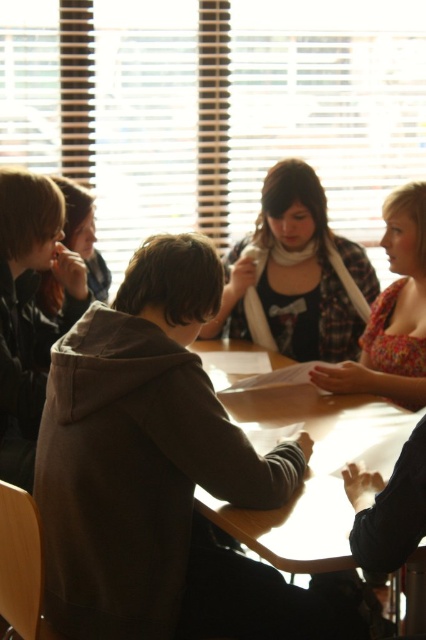
Can you confirm if dark brown hoodie at center is smaller than floral fabric dress at right?

No, dark brown hoodie at center is not smaller than floral fabric dress at right.

Between point (169, 474) and point (394, 244), which one is positioned in front?

Positioned in front is point (169, 474).

Describe the element at coordinates (141, 451) in the screenshot. I see `dark brown hoodie at center` at that location.

Identify the location of dark brown hoodie at center. (141, 451).

Can you confirm if wooden table at center is positioned above plaid fabric shirt at center?

Incorrect, wooden table at center is not positioned above plaid fabric shirt at center.

Is wooden table at center bigger than plaid fabric shirt at center?

Yes, wooden table at center is bigger than plaid fabric shirt at center.

Between point (256, 404) and point (233, 305), which one is positioned in front?

Point (256, 404) is in front.

Locate an element on the screen. wooden table at center is located at coordinates (313, 472).

Is wooden table at center below floral fabric dress at right?

Correct, wooden table at center is located below floral fabric dress at right.

Can you confirm if wooden table at center is bigger than floral fabric dress at right?

Yes, wooden table at center is bigger than floral fabric dress at right.

Who is more forward, (224,394) or (380,374)?

Positioned in front is point (224,394).

This screenshot has width=426, height=640. I want to click on wooden table at center, so click(x=313, y=472).